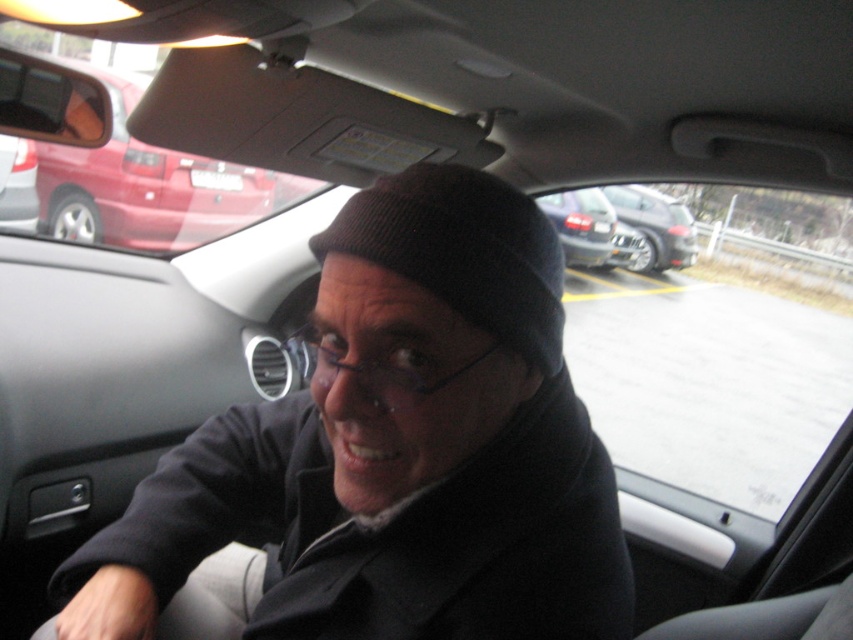
Is black knit cap at center taller than satin black sedan at center?

Indeed, black knit cap at center has a greater height compared to satin black sedan at center.

Is point (579, 426) positioned after point (566, 198)?

No, it is in front of (566, 198).

Is point (606, 518) more distant than point (595, 189)?

No, (606, 518) is closer to viewer.

The image size is (853, 640). Find the location of `black knit cap at center`. black knit cap at center is located at coordinates (392, 452).

Describe the element at coordinates (141, 184) in the screenshot. I see `metallic red van at upper left` at that location.

Where is `metallic red van at upper left`? The image size is (853, 640). metallic red van at upper left is located at coordinates (141, 184).

Can you confirm if black knit beanie at center is wider than metallic red van at upper left?

No.

Measure the distance between black knit beanie at center and camera.

black knit beanie at center is 21.61 inches away from camera.

Who is more forward, [450,216] or [99,196]?

Point [450,216] is more forward.

This screenshot has height=640, width=853. In order to click on black knit beanie at center in this screenshot , I will do `click(462, 250)`.